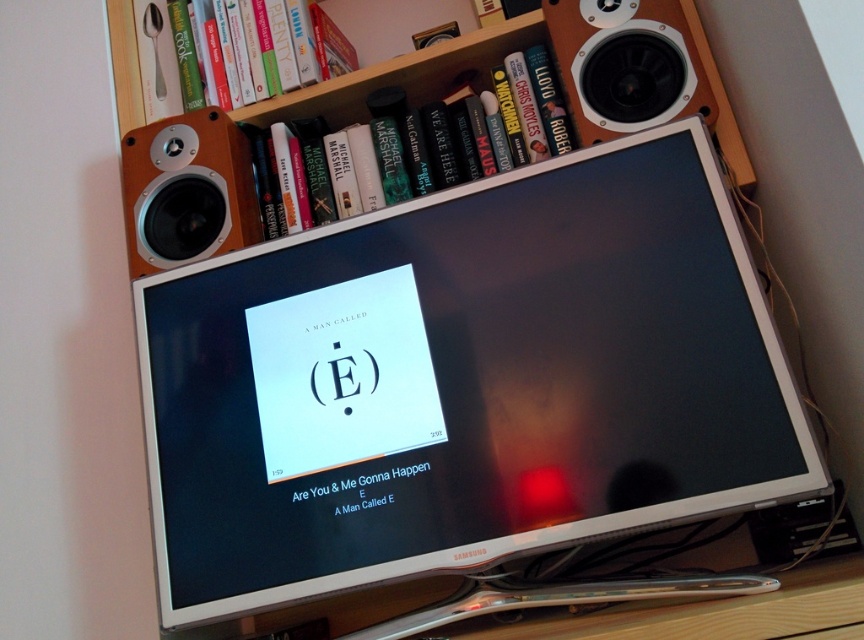
Which of these two, hardcover book at upper center or hardcover book at upper left, stands taller?

With more height is hardcover book at upper center.

The image size is (864, 640). I want to click on hardcover book at upper center, so click(456, 108).

Consider the image. Can you confirm if hardcover book at upper center is positioned to the right of wooden bookshelf at upper center?

Yes, hardcover book at upper center is to the right of wooden bookshelf at upper center.

Locate an element on the screen. The height and width of the screenshot is (640, 864). hardcover book at upper center is located at coordinates (456, 108).

Does hardcover book at upper left appear on the right side of wooden bookshelf at upper center?

Incorrect, hardcover book at upper left is not on the right side of wooden bookshelf at upper center.

In the scene shown: Between hardcover book at upper left and wooden bookshelf at upper center, which one has less height?

With less height is hardcover book at upper left.

Does point (223, 104) come in front of point (324, 84)?

No, it is behind (324, 84).

This screenshot has height=640, width=864. In order to click on hardcover book at upper left in this screenshot , I will do `click(257, 45)`.